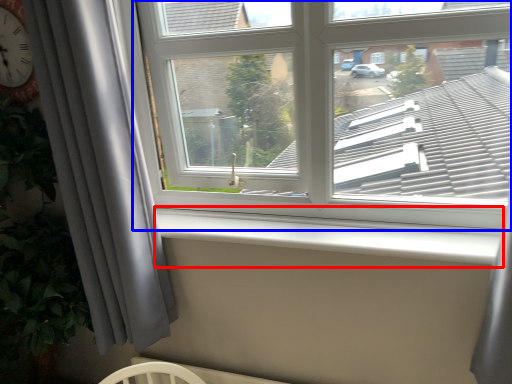
Question: Which object is further to the camera taking this photo, window sill (highlighted by a red box) or window (highlighted by a blue box)?

Choices:
 (A) window sill
 (B) window

Answer: (A)